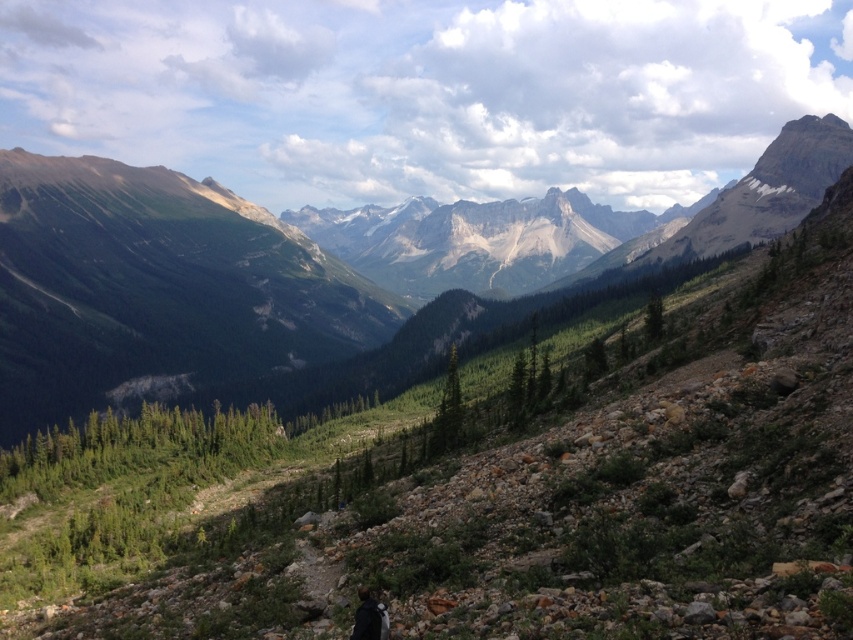
Question: Among these objects, which one is nearest to the camera?

Choices:
 (A) green rocky mountain at center
 (B) black fabric backpack at lower center

Answer: (B)

Question: Can you confirm if green rocky mountain at center is bigger than black fabric backpack at lower center?

Choices:
 (A) no
 (B) yes

Answer: (B)

Question: Which point is farther from the camera taking this photo?

Choices:
 (A) (239, 248)
 (B) (370, 636)

Answer: (A)

Question: Which point is closer to the camera taking this photo?

Choices:
 (A) coord(685,250)
 (B) coord(381,627)

Answer: (B)

Question: Does green rocky mountain at center have a greater width compared to black fabric backpack at lower center?

Choices:
 (A) yes
 (B) no

Answer: (A)

Question: Is green rocky mountain at center further to camera compared to black fabric backpack at lower center?

Choices:
 (A) no
 (B) yes

Answer: (B)